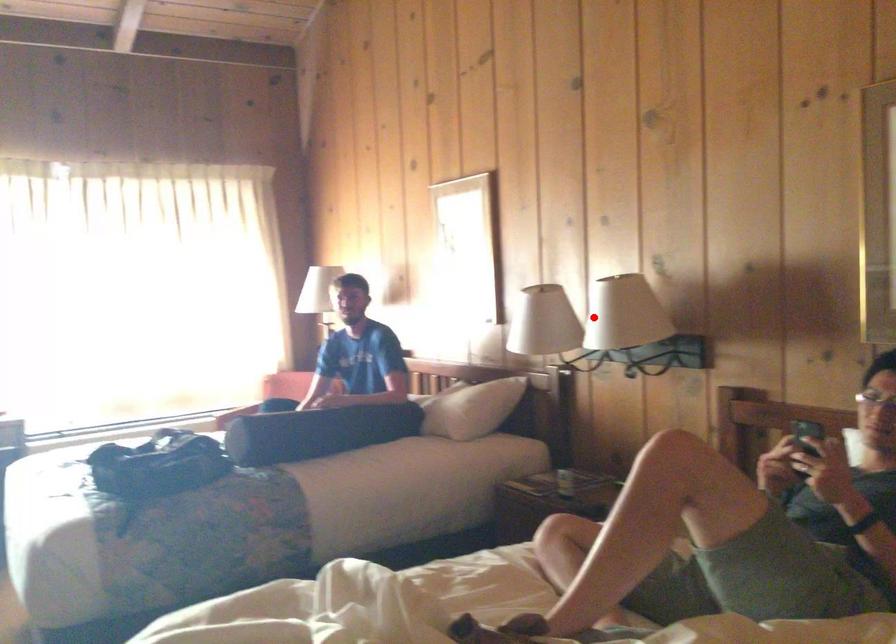
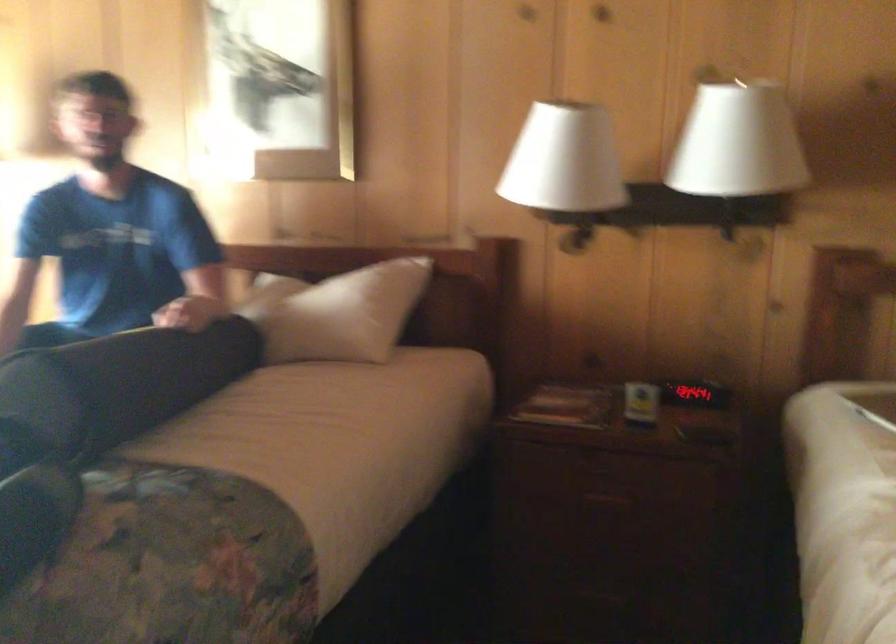
Question: I am providing you with two images of the same scene from different viewpoints. Given a red point in image1, look at the same physical point in image2. Is it:

Choices:
 (A) Closer to the viewpoint
 (B) Farther from the viewpoint

Answer: (A)